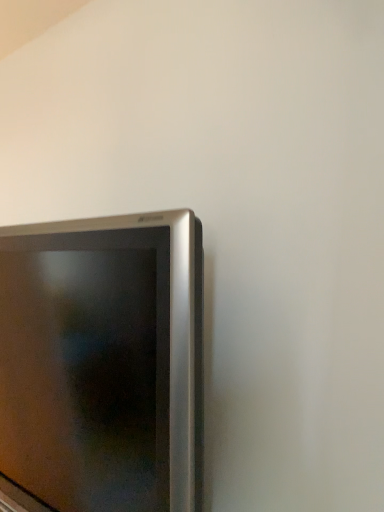
What do you see at coordinates (103, 362) in the screenshot? I see `satin silver television at lower left` at bounding box center [103, 362].

Identify the location of satin silver television at lower left. Image resolution: width=384 pixels, height=512 pixels. (103, 362).

Locate an element on the screen. The image size is (384, 512). satin silver television at lower left is located at coordinates (103, 362).